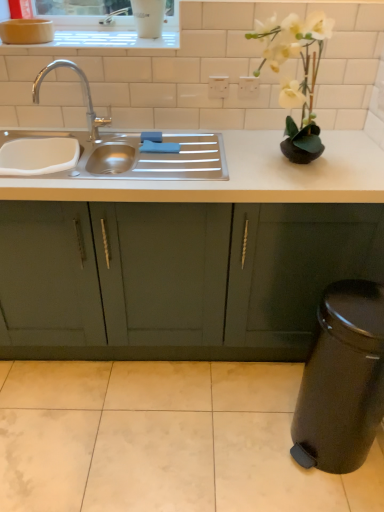
This screenshot has width=384, height=512. What are the coordinates of `free space to the right of white matte vase at upper right` in the screenshot? It's located at (350, 163).